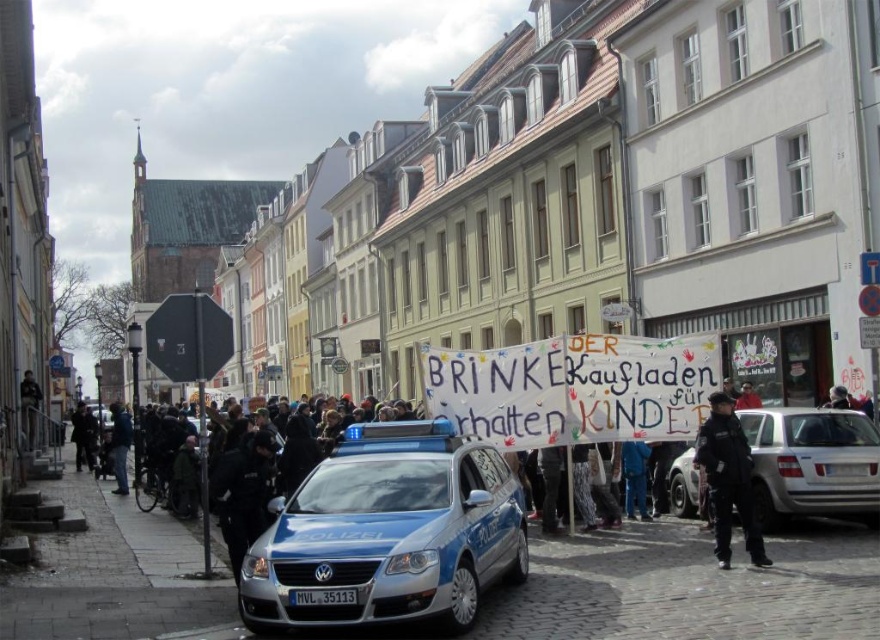
Does silver metallic sedan at center-right have a greater width compared to blue fabric jacket at lower left?

No, silver metallic sedan at center-right is not wider than blue fabric jacket at lower left.

Does point (814, 515) come closer to viewer compared to point (121, 436)?

Yes, point (814, 515) is closer to viewer.

Does point (785, 413) lie behind point (123, 420)?

No, (785, 413) is in front of (123, 420).

The height and width of the screenshot is (640, 880). What are the coordinates of `silver metallic sedan at center-right` in the screenshot? It's located at (812, 464).

Is the position of blue metallic police car at center less distant than that of dark brown coat at lower left?

Yes, blue metallic police car at center is in front of dark brown coat at lower left.

Is blue metallic police car at center above dark brown coat at lower left?

Indeed, blue metallic police car at center is positioned over dark brown coat at lower left.

Identify the location of blue metallic police car at center. (387, 532).

Between silver metallic sedan at center-right and black uniform at center, which one is positioned higher?

black uniform at center

Looking at this image, between silver metallic sedan at center-right and black uniform at center, which one is positioned lower?

silver metallic sedan at center-right is lower down.

Identify the location of silver metallic sedan at center-right. Image resolution: width=880 pixels, height=640 pixels. (812, 464).